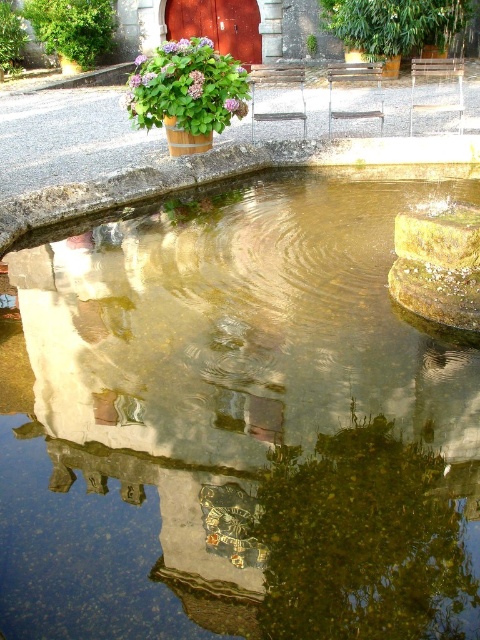
Between green bamboo at upper right and green leafy tree at upper left, which one has more height?

green bamboo at upper right is taller.

What do you see at coordinates (396, 26) in the screenshot? Image resolution: width=480 pixels, height=640 pixels. I see `green bamboo at upper right` at bounding box center [396, 26].

The image size is (480, 640). What do you see at coordinates (396, 26) in the screenshot?
I see `green bamboo at upper right` at bounding box center [396, 26].

Where is `green bamboo at upper right`? This screenshot has height=640, width=480. green bamboo at upper right is located at coordinates (396, 26).

Is the position of clear water at center less distant than that of green leafy tree at upper left?

Yes, it is in front of green leafy tree at upper left.

Is point (194, 268) positioned behind point (35, 3)?

No, it is in front of (35, 3).

The height and width of the screenshot is (640, 480). Find the location of `clear water at center`. clear water at center is located at coordinates (236, 424).

Is clear water at center to the left of green bamboo at upper right from the viewer's perspective?

Yes, clear water at center is to the left of green bamboo at upper right.

Find the location of a particular element. This screenshot has height=640, width=480. clear water at center is located at coordinates (236, 424).